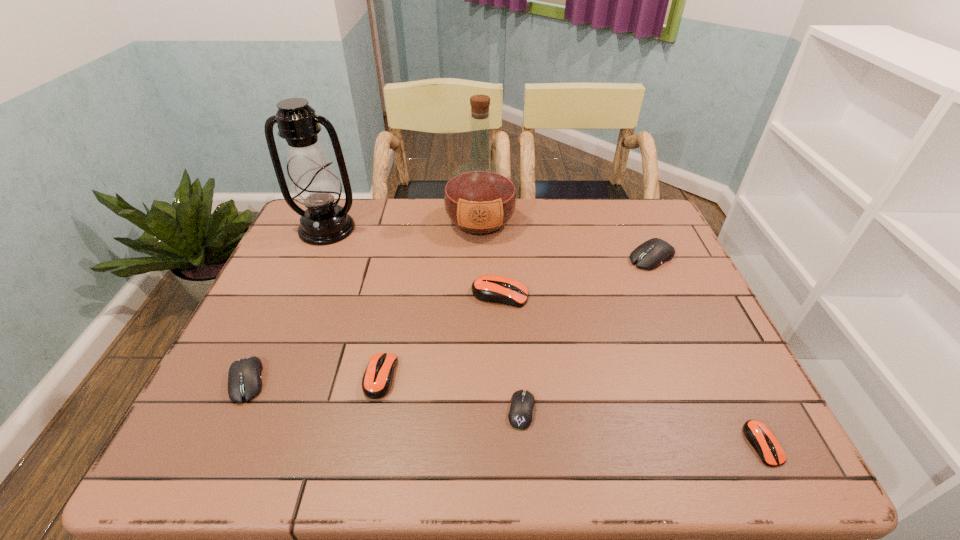
Where is `free space located on the left of the smallest orange computer mouse`? free space located on the left of the smallest orange computer mouse is located at coordinates (582, 444).

Where is `liquor positioned at the far edge`? The width and height of the screenshot is (960, 540). liquor positioned at the far edge is located at coordinates (480, 197).

Where is `oil lamp that is at the far edge`? oil lamp that is at the far edge is located at coordinates (314, 184).

In order to click on oil lamp positioned at the left edge in this screenshot , I will do `click(314, 184)`.

Find the location of a particular element. The height and width of the screenshot is (540, 960). computer equipment that is at the left edge is located at coordinates (244, 377).

You are a GUI agent. You are given a task and a screenshot of the screen. Output one action in this format:
    pyautogui.click(x=<x>, y=<y>)
    Task: Click on the object that is at the far left corner
    This screenshot has height=540, width=960.
    Given the screenshot: What is the action you would take?
    pyautogui.click(x=314, y=184)

You are a GUI agent. You are given a task and a screenshot of the screen. Output one action in this format:
    pyautogui.click(x=<x>, y=<y>)
    Task: Click on the object at the near right corner
    This screenshot has width=960, height=540.
    Given the screenshot: What is the action you would take?
    pyautogui.click(x=762, y=439)

Where is `free location at the far edge`? free location at the far edge is located at coordinates (575, 213).

Identify the location of free space at the near edge of the desktop. The width and height of the screenshot is (960, 540). (644, 448).

Locate an element on the screen. The image size is (960, 540). free space at the left edge of the desktop is located at coordinates (238, 357).